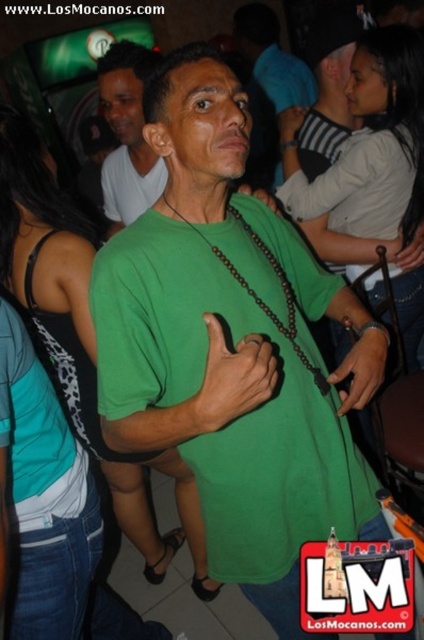
You are at a party and want to take a photo with the two men in the center. The green matte shirt at center and the matte black shirt at center are standing close to each other. Which one should you ask to move back so that both can fit in the frame?

The green matte shirt at center is bigger than the matte black shirt at center, so you should ask the green matte shirt at center to move back so that both can fit in the frame.

You are taking a photo of two points in a crowded room. The points are labeled as point (346, 454) and point (114, 170). If you want to focus on the point that is closer to you, which one should you choose?

Point (346, 454) is closer to the camera than point (114, 170), so you should focus on point (346, 454).